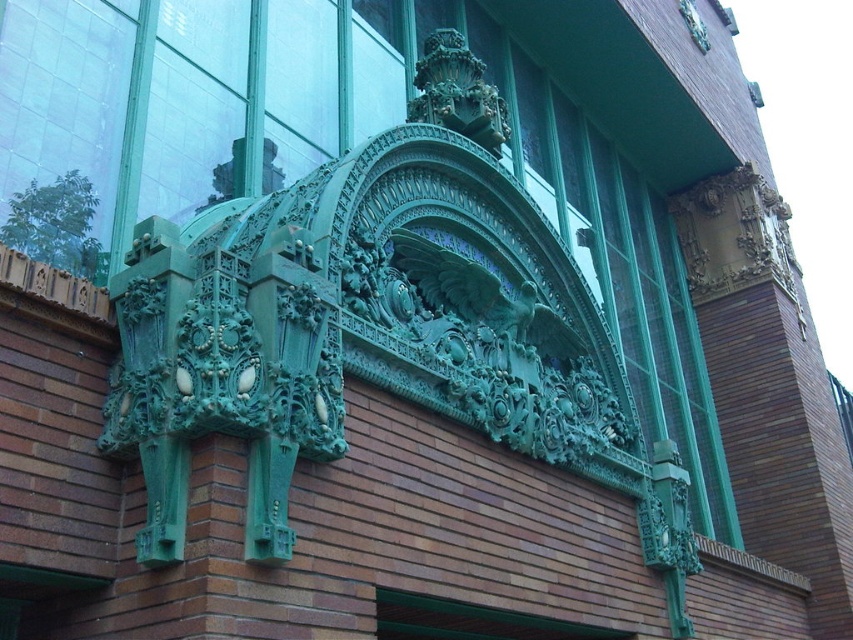
Question: Among these objects, which one is farthest from the camera?

Choices:
 (A) green patina eagle at center
 (B) green patina ornament at center

Answer: (B)

Question: Can you confirm if green patina eagle at center is positioned to the right of green patina ornament at center?

Choices:
 (A) no
 (B) yes

Answer: (B)

Question: Which point is farther from the camera taking this photo?

Choices:
 (A) (405, 266)
 (B) (434, 115)

Answer: (B)

Question: Is green patina eagle at center positioned behind green patina ornament at center?

Choices:
 (A) yes
 (B) no

Answer: (B)

Question: Which of the following is the farthest from the observer?

Choices:
 (A) (467, 284)
 (B) (456, 35)

Answer: (B)

Question: Can you confirm if green patina eagle at center is positioned below green patina ornament at center?

Choices:
 (A) yes
 (B) no

Answer: (A)